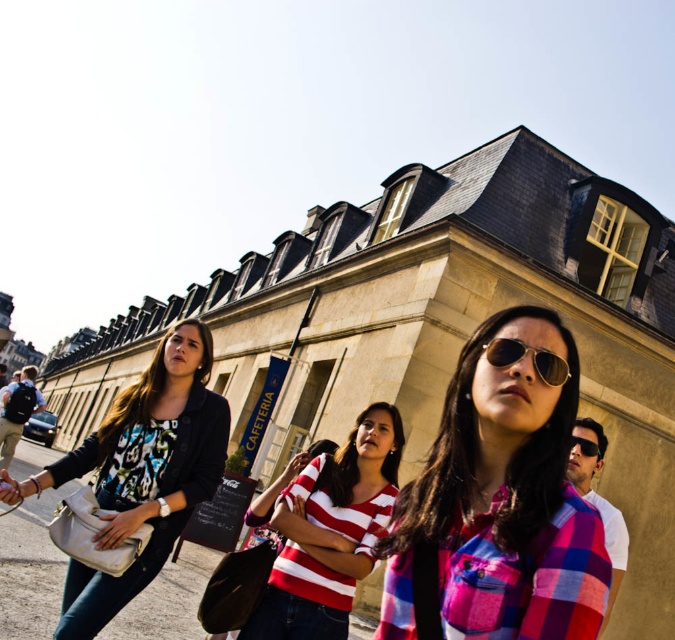
Is striped cotton shirt at center bigger than sunglasses at center?

Correct, striped cotton shirt at center is larger in size than sunglasses at center.

Between point (321, 458) and point (540, 360), which one is positioned behind?

Positioned behind is point (321, 458).

Does point (369, 556) lie in front of point (502, 342)?

No, it is not.

Locate an element on the screen. striped cotton shirt at center is located at coordinates (329, 531).

The height and width of the screenshot is (640, 675). What do you see at coordinates (531, 358) in the screenshot?
I see `sunglasses at center` at bounding box center [531, 358].

Can you confirm if sunglasses at center is positioned above matte black sunglasses at center?

Yes.

Where is `sunglasses at center`? sunglasses at center is located at coordinates (531, 358).

Which is more to the right, pink plaid shirt at center or matte black sunglasses at center?

Positioned to the right is matte black sunglasses at center.

Is pink plaid shirt at center taller than matte black sunglasses at center?

Correct, pink plaid shirt at center is much taller as matte black sunglasses at center.

Measure the distance between point (437,436) and camera.

Point (437,436) and camera are 24.54 meters apart.

Where is `pink plaid shirt at center`? pink plaid shirt at center is located at coordinates (500, 500).